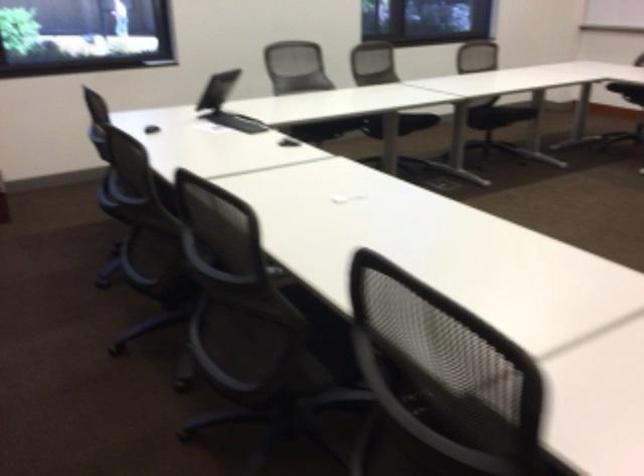
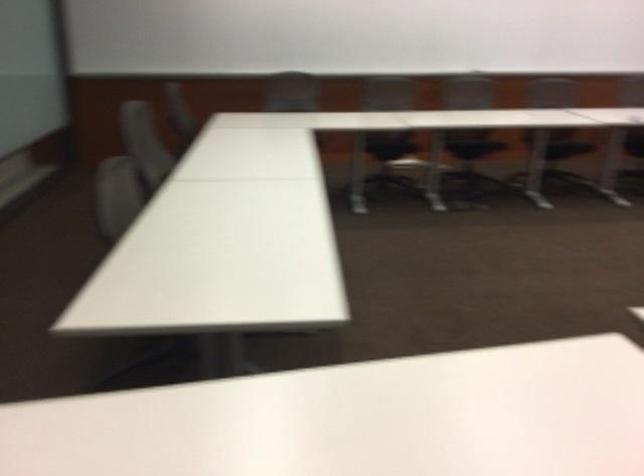
First-person continuous shooting, in which direction is the camera rotating?

The camera rotated toward right-down.